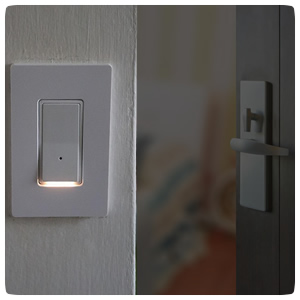
This screenshot has height=300, width=300. I want to click on metal cover for door handle, so click(256, 180).